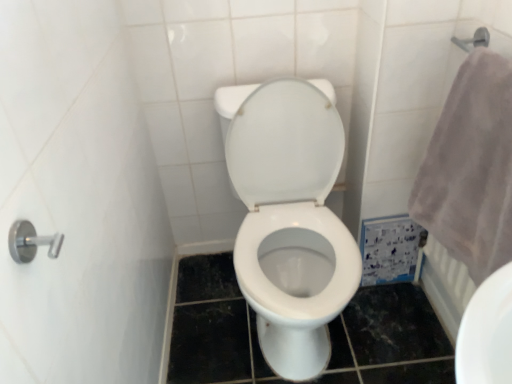
Question: Does white glossy toilet at center have a smaller size compared to gray fluffy towel at right?

Choices:
 (A) yes
 (B) no

Answer: (B)

Question: Does white glossy toilet at center have a greater width compared to gray fluffy towel at right?

Choices:
 (A) yes
 (B) no

Answer: (A)

Question: From the image's perspective, is white glossy toilet at center above gray fluffy towel at right?

Choices:
 (A) yes
 (B) no

Answer: (B)

Question: Is white glossy toilet at center outside of gray fluffy towel at right?

Choices:
 (A) no
 (B) yes

Answer: (B)

Question: Can you confirm if white glossy toilet at center is shorter than gray fluffy towel at right?

Choices:
 (A) no
 (B) yes

Answer: (A)

Question: Can you confirm if white glossy toilet at center is taller than gray fluffy towel at right?

Choices:
 (A) yes
 (B) no

Answer: (A)

Question: Considering the relative positions of gray fluffy towel at right and white glossy toilet at center in the image provided, is gray fluffy towel at right in front of white glossy toilet at center?

Choices:
 (A) yes
 (B) no

Answer: (A)

Question: Is gray fluffy towel at right further to the viewer compared to white glossy toilet at center?

Choices:
 (A) yes
 (B) no

Answer: (B)

Question: From a real-world perspective, is gray fluffy towel at right over white glossy toilet at center?

Choices:
 (A) no
 (B) yes

Answer: (B)

Question: Can you confirm if gray fluffy towel at right is thinner than white glossy toilet at center?

Choices:
 (A) yes
 (B) no

Answer: (A)

Question: Does gray fluffy towel at right have a greater height compared to white glossy toilet at center?

Choices:
 (A) yes
 (B) no

Answer: (B)

Question: Could you tell me if gray fluffy towel at right is turned towards white glossy toilet at center?

Choices:
 (A) yes
 (B) no

Answer: (A)

Question: From the image's perspective, relative to white glossy toilet at center, is gray fluffy towel at right above or below?

Choices:
 (A) below
 (B) above

Answer: (B)